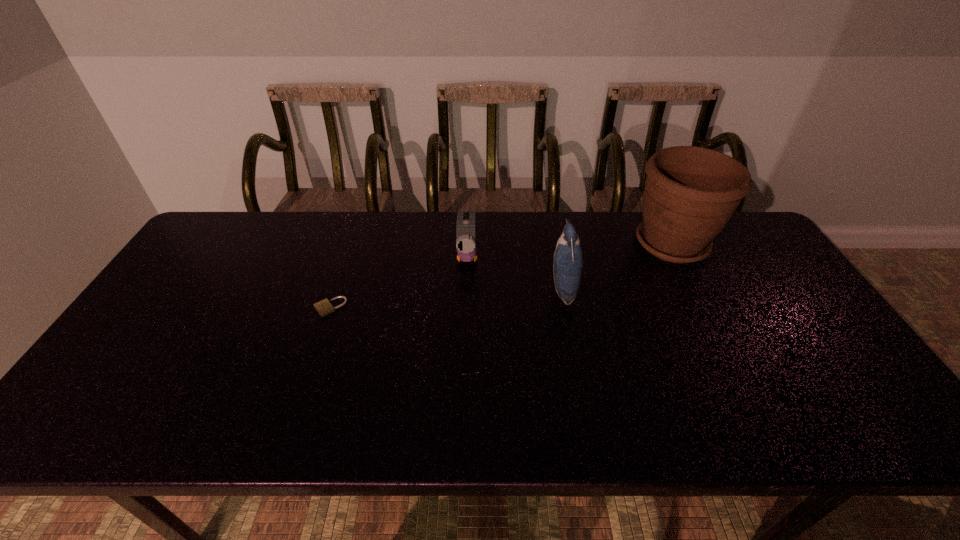
This screenshot has height=540, width=960. I want to click on free spot located 0.360m at the tip of the taller bird's beak, so click(424, 288).

Locate an element on the screen. The image size is (960, 540). vacant area located at the tip of the taller bird's beak is located at coordinates (515, 288).

At what (x,y) coordinates should I click in order to perform the action: click on vacant space situated 0.100m at the beak of the second object from left to right. Please return your answer as a coordinate pair (x, y). Looking at the image, I should click on (466, 299).

The height and width of the screenshot is (540, 960). I want to click on free region located 0.240m on the back of the padlock, so click(x=351, y=244).

The width and height of the screenshot is (960, 540). I want to click on flowerpot that is at the far edge, so click(x=690, y=194).

Find the location of a particular element. Image resolution: width=960 pixels, height=540 pixels. bird located at the far edge is located at coordinates (466, 247).

The height and width of the screenshot is (540, 960). What are the coordinates of `object at the right edge` in the screenshot? It's located at (690, 194).

Where is `object at the far right corner`? This screenshot has height=540, width=960. object at the far right corner is located at coordinates (690, 194).

The image size is (960, 540). Identify the location of free region at the far edge. (560, 215).

I want to click on blank area at the near edge, so click(566, 414).